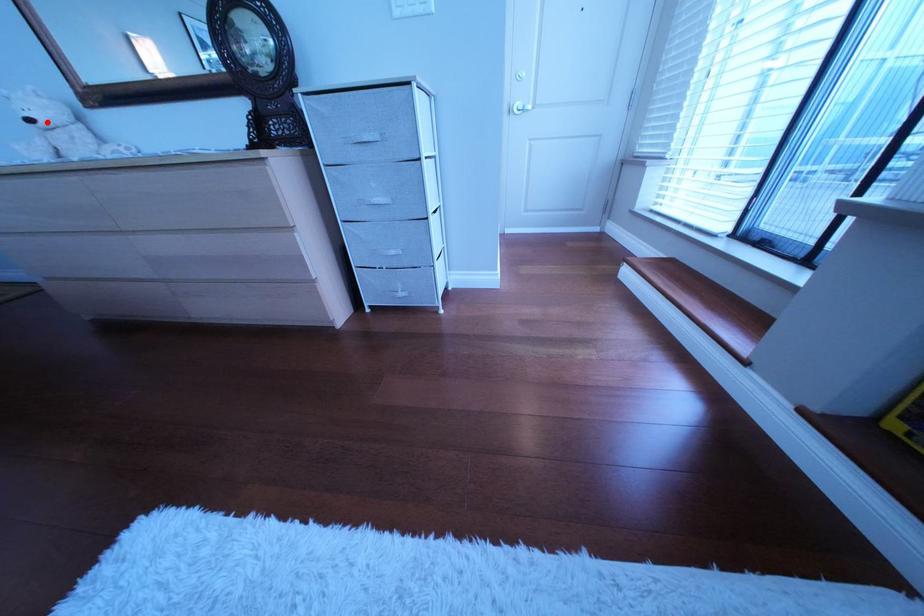
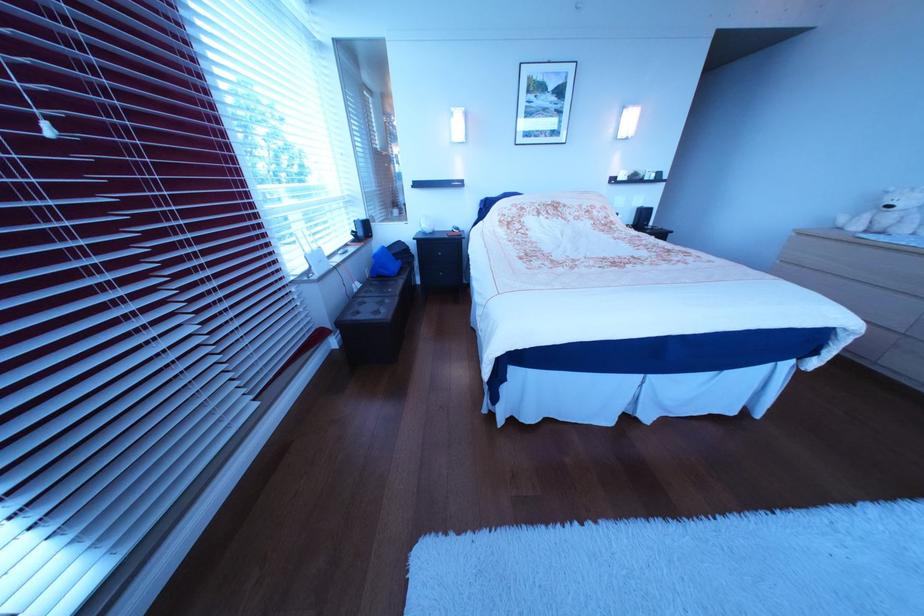
Question: I am providing you with two images of the same scene from different viewpoints. In image1, a red point is highlighted. Considering the same 3D point in image2, which of the following is correct?

Choices:
 (A) It is closer
 (B) It is farther

Answer: (B)